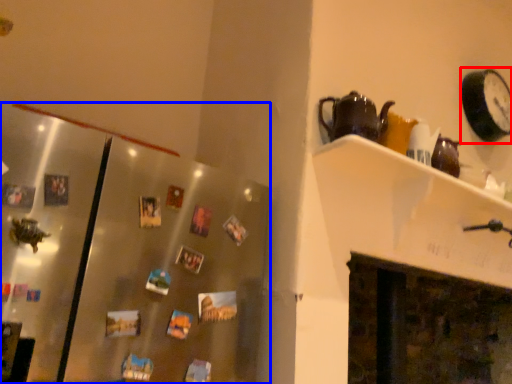
Question: Among these objects, which one is nearest to the camera, clock (highlighted by a red box) or glass door (highlighted by a blue box)?

Choices:
 (A) clock
 (B) glass door

Answer: (B)